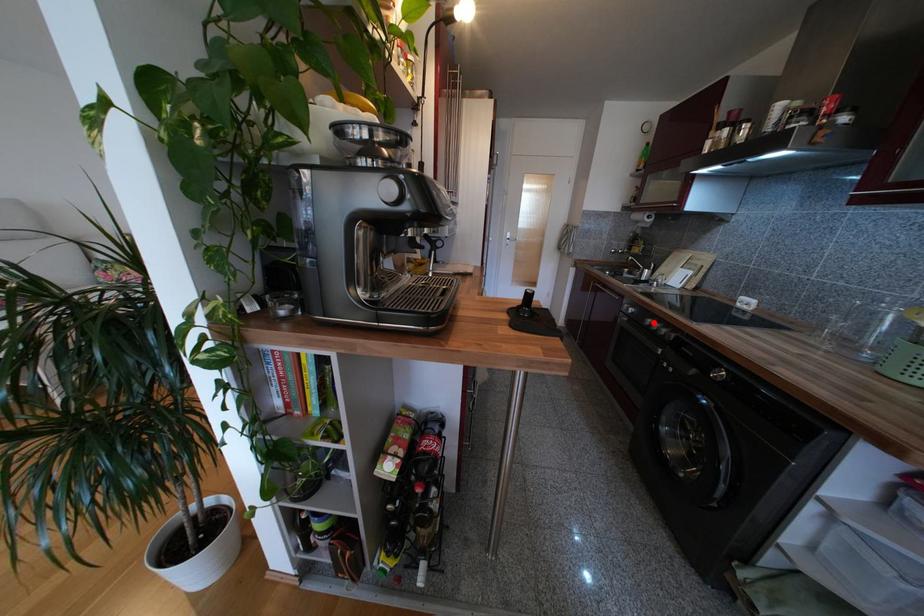
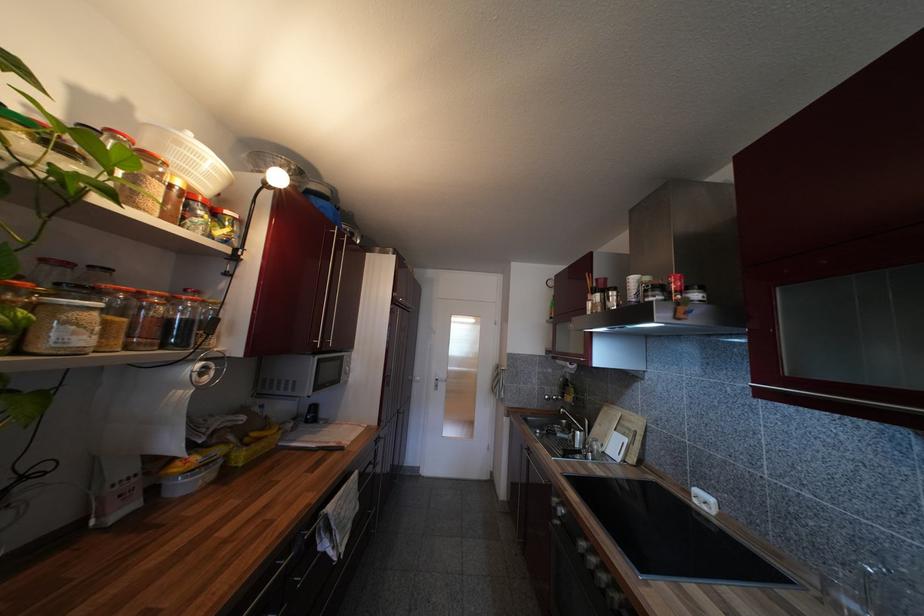
Question: I am providing you with two images of the same scene from different viewpoints. Given a red point in image1, look at the same physical point in image2. Is it:

Choices:
 (A) Closer to the viewpoint
 (B) Farther from the viewpoint

Answer: (B)